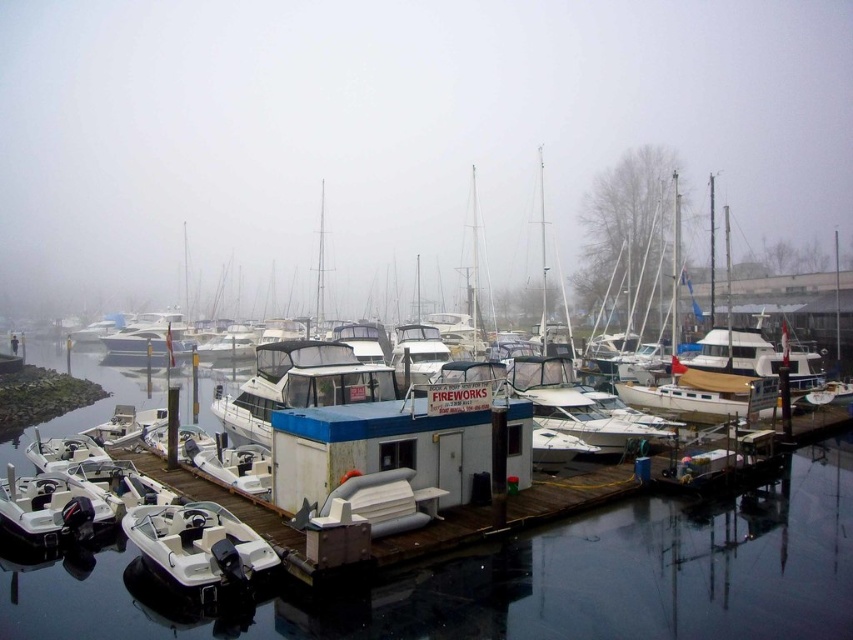
Question: Based on their relative distances, which object is farther from the transparent water at center?

Choices:
 (A) white rubber boat at lower left
 (B) white matte houseboat at center

Answer: (B)

Question: Does transparent water at center lie in front of white matte houseboat at center?

Choices:
 (A) yes
 (B) no

Answer: (A)

Question: Does transparent water at center appear on the left side of white matte houseboat at center?

Choices:
 (A) no
 (B) yes

Answer: (B)

Question: Among these points, which one is nearest to the camera?

Choices:
 (A) (228, 531)
 (B) (784, 496)

Answer: (A)

Question: Can you confirm if transparent water at center is positioned to the right of white rubber boat at lower left?

Choices:
 (A) yes
 (B) no

Answer: (A)

Question: Which point is farther from the camera taking this photo?

Choices:
 (A) (183, 540)
 (B) (808, 368)

Answer: (B)